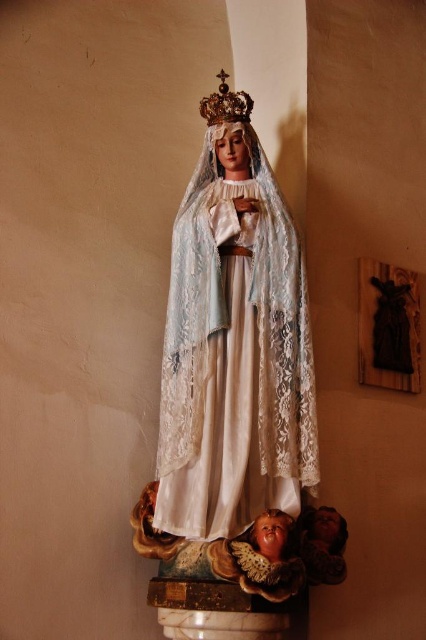
Between point (264, 177) and point (244, 106), which one is positioned behind?

The point (264, 177) is more distant.

Does white lace statue at center appear on the left side of gold metallic crown at upper center?

Incorrect, white lace statue at center is not on the left side of gold metallic crown at upper center.

Is point (229, 396) less distant than point (239, 102)?

Yes, point (229, 396) is closer to viewer.

Where is `white lace statue at center`? white lace statue at center is located at coordinates (238, 387).